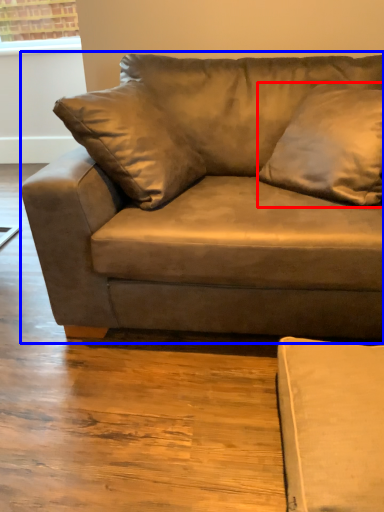
Question: Among these objects, which one is farthest to the camera, pillow (highlighted by a red box) or studio couch (highlighted by a blue box)?

Choices:
 (A) pillow
 (B) studio couch

Answer: (A)